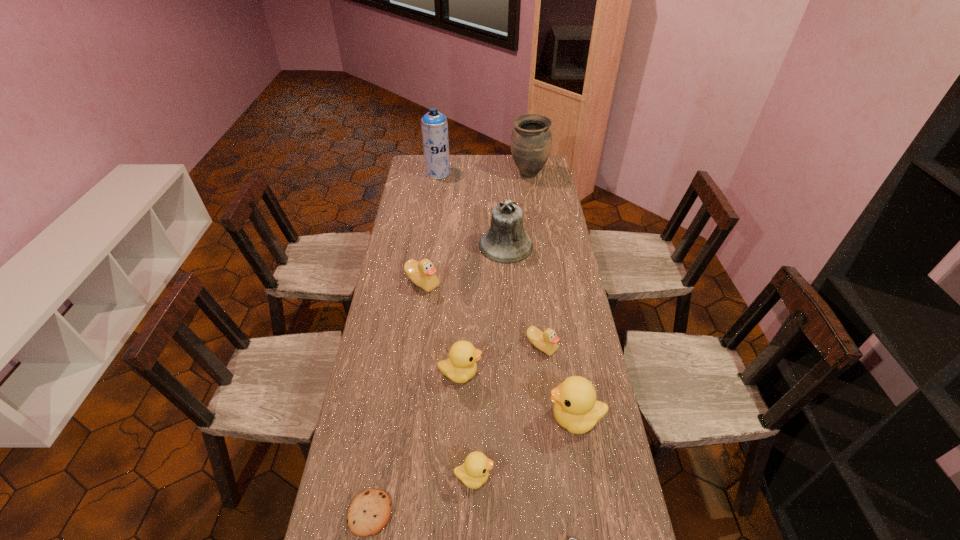
Locate an element on the screen. Image resolution: width=960 pixels, height=540 pixels. empty location between the ninth tallest object and the fifth farthest object is located at coordinates (456, 430).

This screenshot has height=540, width=960. I want to click on free spot between the cookie and the fourth farthest object, so click(x=396, y=398).

Image resolution: width=960 pixels, height=540 pixels. I want to click on empty space between the farthest duck and the second smallest yellow duck, so click(x=442, y=328).

Locate an element on the screen. The image size is (960, 540). free area in between the nearest duck and the bell is located at coordinates (490, 361).

Find the location of a particular element. The image size is (960, 540). object that ranks as the closest to the bell is located at coordinates (422, 273).

I want to click on object that is the third closest to the third nearest duck, so pos(474,472).

Locate which duck ranks in proximity to the shortest object. Please provide its 2D coordinates. Your answer should be formatted as a tuple, i.e. [(x, y)], where the tuple contains the x and y coordinates of a point satisfying the conditions above.

[(474, 472)]

You are a GUI agent. You are given a task and a screenshot of the screen. Output one action in this format:
    pyautogui.click(x=<x>, y=<y>)
    Task: Click on the duck that stands as the fourth closest to the farthest duck
    This screenshot has height=540, width=960.
    Given the screenshot: What is the action you would take?
    pyautogui.click(x=474, y=472)

Locate an element on the screen. Image resolution: width=960 pixels, height=540 pixels. yellow duck that is the second closest to the nearest duck is located at coordinates (461, 366).

Point out which yellow duck is positioned as the third nearest to the urn. Please provide its 2D coordinates. Your answer should be formatted as a tuple, i.e. [(x, y)], where the tuple contains the x and y coordinates of a point satisfying the conditions above.

[(474, 472)]